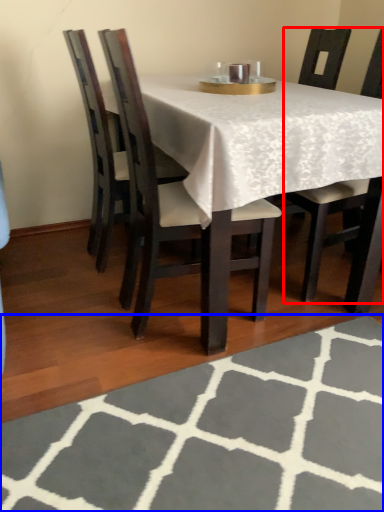
Question: Which point is closer to the camera, chair (highlighted by a red box) or place mat (highlighted by a blue box)?

Choices:
 (A) chair
 (B) place mat

Answer: (B)